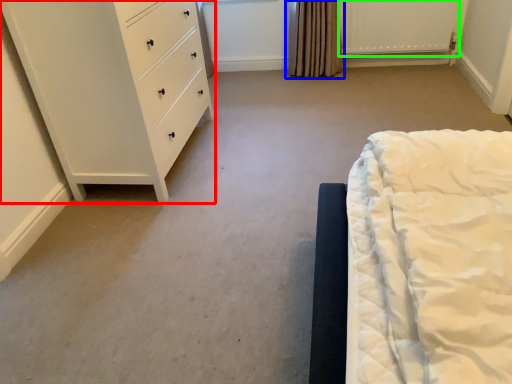
Question: Which is farther away from chest of drawers (highlighted by a red box)? curtain (highlighted by a blue box) or radiator (highlighted by a green box)?

Choices:
 (A) curtain
 (B) radiator

Answer: (B)